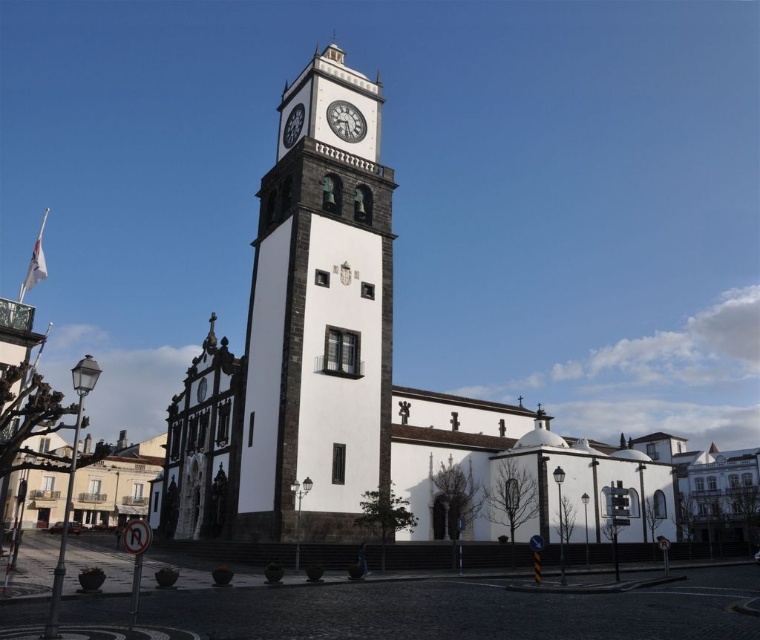
Which of these two, white stucco church at center or white stone clock at upper center, stands shorter?

With less height is white stone clock at upper center.

Is white stucco church at center shorter than white stone clock at upper center?

In fact, white stucco church at center may be taller than white stone clock at upper center.

Does point (236, 538) lie behind point (296, 104)?

No, (236, 538) is closer to viewer.

I want to click on white stucco church at center, so click(x=363, y=385).

Is white matte clock at upper center below white stone clock at upper center?

No, white matte clock at upper center is not below white stone clock at upper center.

From the picture: Which is more to the right, white matte clock at upper center or white stone clock at upper center?

white matte clock at upper center

Does point (339, 122) lie in front of point (282, 141)?

That is True.

The image size is (760, 640). In order to click on white matte clock at upper center in this screenshot , I will do `click(344, 120)`.

Which is more to the right, white stone clock tower at center or white matte clock at upper center?

From the viewer's perspective, white matte clock at upper center appears more on the right side.

Which is above, white stone clock tower at center or white matte clock at upper center?

→ Positioned higher is white matte clock at upper center.

Who is more distant from viewer, (290, 417) or (333, 116)?

The point (333, 116) is behind.

Find the location of `white stone clock tower at center`. white stone clock tower at center is located at coordinates (318, 320).